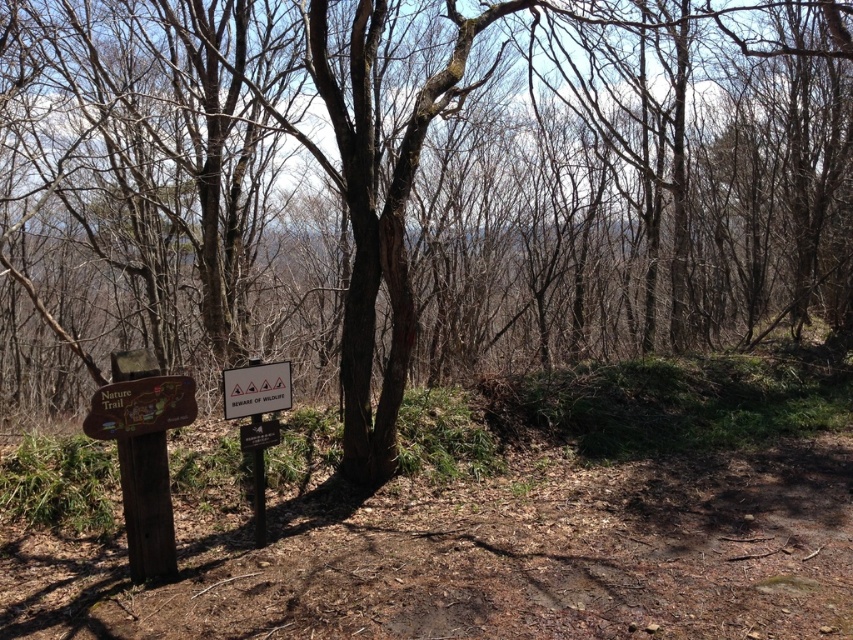
Question: Which point is closer to the camera?

Choices:
 (A) (x=123, y=364)
 (B) (x=241, y=413)
 (C) (x=277, y=435)
 (D) (x=166, y=410)

Answer: (A)

Question: Can you confirm if wooden sign at left is bigger than metallic rectangular sign at center?

Choices:
 (A) yes
 (B) no

Answer: (A)

Question: Which object appears farthest from the camera in this image?

Choices:
 (A) brown wooden signpost at left
 (B) metallic rectangular sign at center
 (C) black plastic sign at lower center

Answer: (C)

Question: Does brown wooden signpost at left appear on the right side of wooden sign at left?

Choices:
 (A) yes
 (B) no

Answer: (B)

Question: Is wooden sign at left wider than metallic rectangular sign at center?

Choices:
 (A) no
 (B) yes

Answer: (B)

Question: Which point is farther from the camera taking this photo?

Choices:
 (A) (149, 497)
 (B) (91, 412)
 (C) (241, 376)
 (D) (279, 433)

Answer: (D)